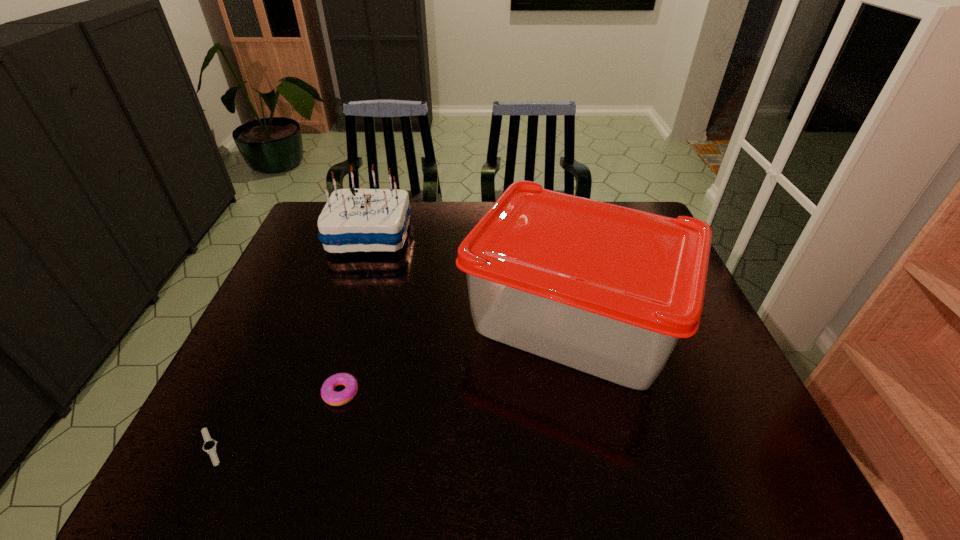
In order to click on object that is positioned at the far edge in this screenshot , I will do `click(353, 220)`.

This screenshot has height=540, width=960. What are the coordinates of `object located at the near edge` in the screenshot? It's located at (209, 445).

You are a GUI agent. You are given a task and a screenshot of the screen. Output one action in this format:
    pyautogui.click(x=<x>, y=<y>)
    Task: Click on the birthday cake present at the left edge
    This screenshot has height=540, width=960.
    Given the screenshot: What is the action you would take?
    pyautogui.click(x=353, y=220)

This screenshot has width=960, height=540. Find the location of `watch that is at the left edge`. watch that is at the left edge is located at coordinates (209, 445).

Where is `object that is positioned at the right edge`? object that is positioned at the right edge is located at coordinates (608, 290).

The width and height of the screenshot is (960, 540). I want to click on object at the far left corner, so click(x=353, y=220).

Where is `object that is at the near left corner`? This screenshot has height=540, width=960. object that is at the near left corner is located at coordinates (209, 445).

Identify the location of vacant area at the far edge of the desktop. (476, 216).

This screenshot has width=960, height=540. What are the coordinates of `vacant space at the right edge of the desktop` in the screenshot? It's located at (705, 415).

Find the location of a particular element. free region at the near left corner is located at coordinates (194, 481).